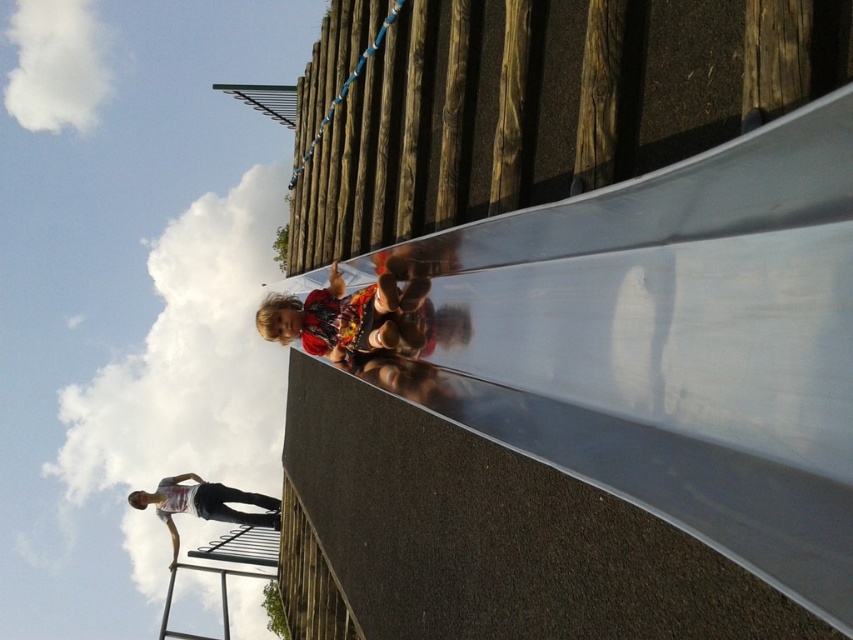
Based on the coordinates provided in the image, where is the white cotton tank top at upper left located?

The white cotton tank top at upper left is located at the coordinates point [204,504].

You are a photographer trying to capture the child sliding down the slide. You need to position yourself so that you can see both the white cotton tank top at upper left and the metallic silver ladder at lower left in your shot. Which side of the ladder should you stand on to ensure both objects are visible?

You should stand to the right side of the metallic silver ladder at lower left. Since the white cotton tank top at upper left is to the left of the ladder, positioning yourself to the right allows you to capture both objects in your frame.